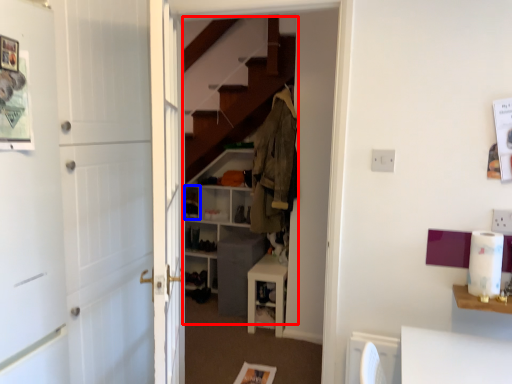
Question: Which point is closer to the camera, dresser (highlighted by a red box) or shelf (highlighted by a blue box)?

Choices:
 (A) dresser
 (B) shelf

Answer: (A)